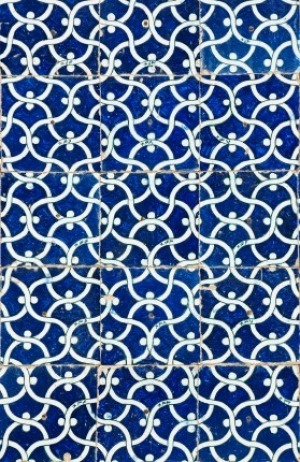
Find the location of a particular element. This screenshot has height=462, width=300. row 3 of tile is located at coordinates (143, 207).